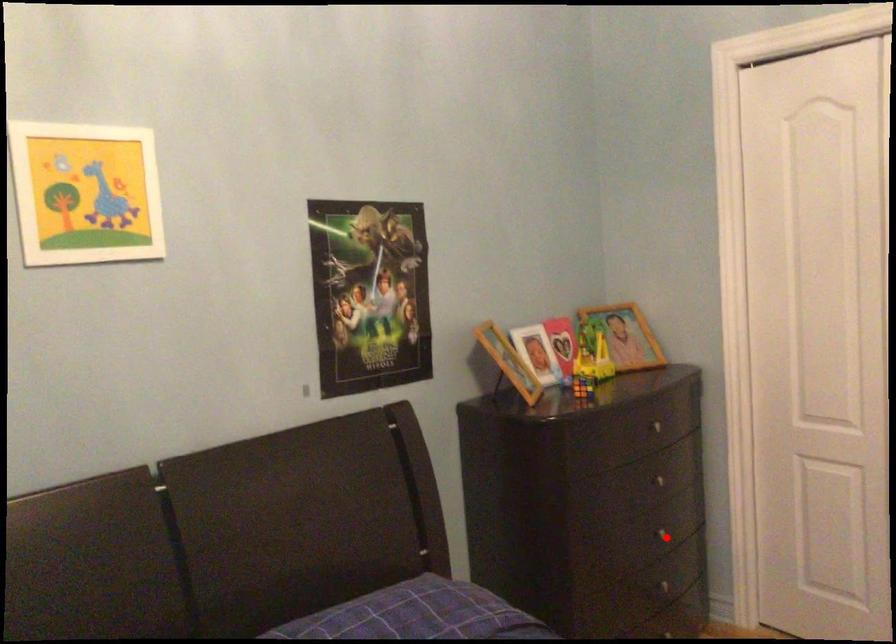
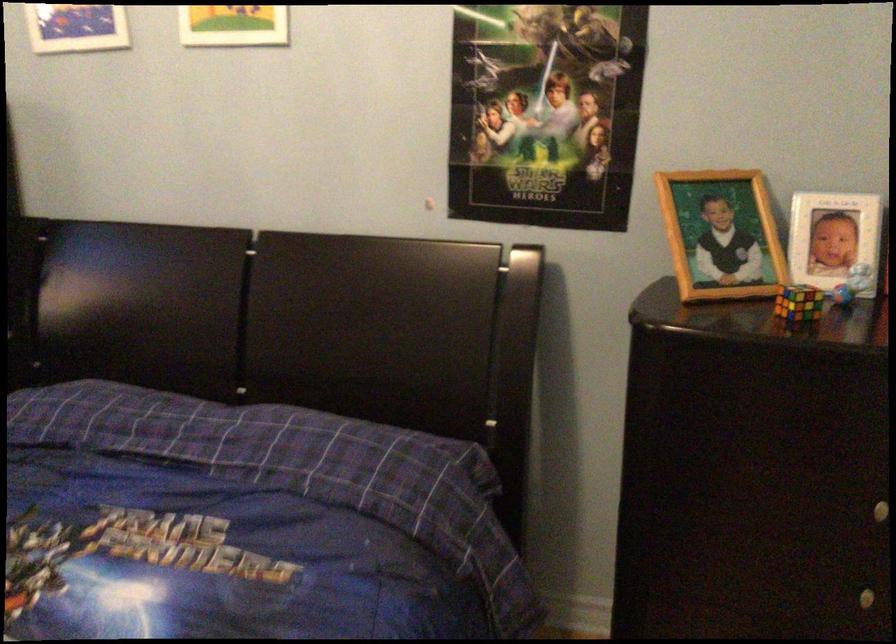
Locate, in the second image, the point that corresponds to the highlighted location in the first image.

(868, 597)